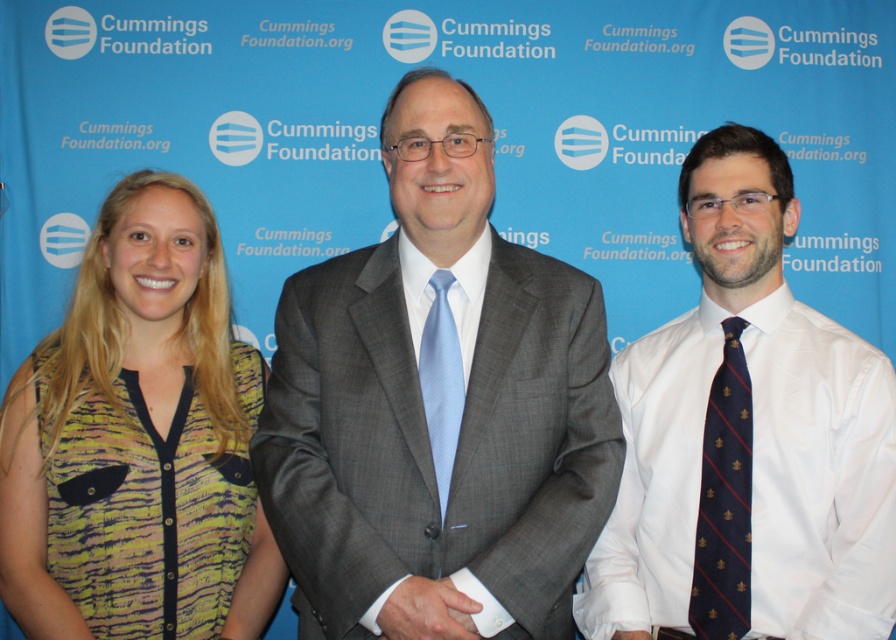
You are a fashion designer observing the Cummings Foundation event backdrop. You notice the gray textured suit at center and the printed fabric blouse at left. Which clothing item is positioned higher in the image?

The gray textured suit at center is located above the printed fabric blouse at left, so it is positioned higher in the image.

You are a fashion designer observing the image. You need to determine which clothing item is taller between the gray textured suit at center and the printed fabric blouse at left. Which one is taller?

The gray textured suit at center has a greater height compared to the printed fabric blouse at left, so the gray textured suit at center is taller.

You are a photographer standing at the position of the viewer. You want to ensure that the gray textured suit at center is in focus while capturing the image. If your camera has a depth of field of 4 feet, will the suit be in focus?

The gray textured suit at center is 5.08 feet away from the viewer. Since the depth of field is 4 feet, the distance exceeds the depth of field range, so the suit may not be in focus. Adjust your camera settings or move closer to ensure it is sharp.